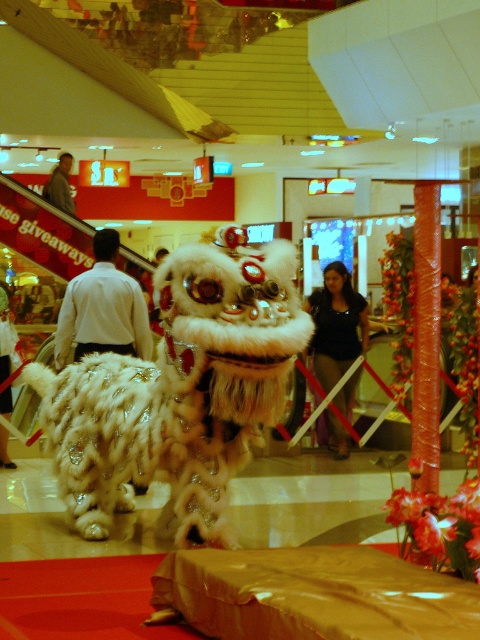
Who is positioned more to the right, white fluffy lion at center or gray fabric jacket at upper left?

Positioned to the right is white fluffy lion at center.

Is point (310, 312) closer to viewer compared to point (62, 205)?

Yes, it is.

The image size is (480, 640). Identify the location of white fluffy lion at center. (336, 324).

Between white fur coat at center and gray fabric jacket at upper left, which one has more height?

white fur coat at center

How far apart are white fur coat at center and gray fabric jacket at upper left?

6.09 meters

Where is `white fur coat at center`? The width and height of the screenshot is (480, 640). white fur coat at center is located at coordinates (103, 308).

Between white fur coat at center and white fluffy lion at center, which one appears on the right side from the viewer's perspective?

Positioned to the right is white fluffy lion at center.

Is point (96, 236) positioned behind point (350, 404)?

No, (96, 236) is closer to viewer.

Which is in front, point (95, 314) or point (361, 301)?

Positioned in front is point (95, 314).

At what (x,y) coordinates should I click in order to perform the action: click on white fur coat at center. Please return your answer as a coordinate pair (x, y). This screenshot has height=640, width=480. Looking at the image, I should click on (103, 308).